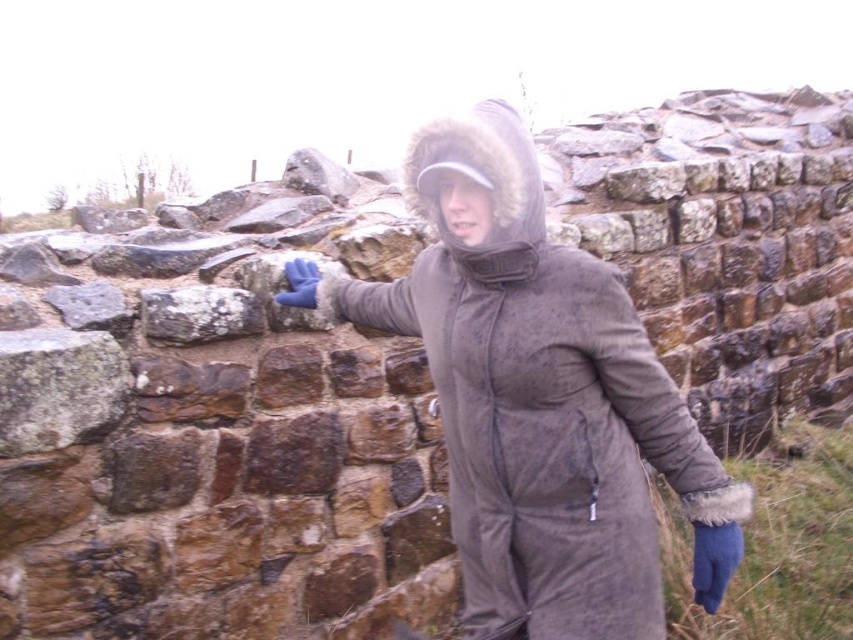
You are a drone operator trying to capture a photo of the person near the stone wall. The camera is positioned at point A, which is at point (225, 312). You need to adjust the camera to point B at point (302, 268). Will moving the camera from point A to point B require moving it closer to the person?

Point (225, 312) is in front of point (302, 268). Moving the camera from point A to point B would mean moving it away from the person, so it would not require moving closer to them.

You are a fashion designer analyzing the placement of clothing in winter scenes. In the image provided, where is the brown fuzzy coat at center positioned relative to the stone wall?

The brown fuzzy coat at center is positioned at coordinates point (543, 401) relative to the stone wall.

Consider the image. You are a fashion designer observing the winter outfit of a person in the image. You need to check if the distance between the brown fuzzy coat at center and the blue synthetic glove at upper center is less than 35 inches to ensure proper fit. Can you confirm this?

The brown fuzzy coat at center is 34.07 inches from the blue synthetic glove at upper center, which is less than 35 inches. Therefore, the distance meets the required fit criteria.